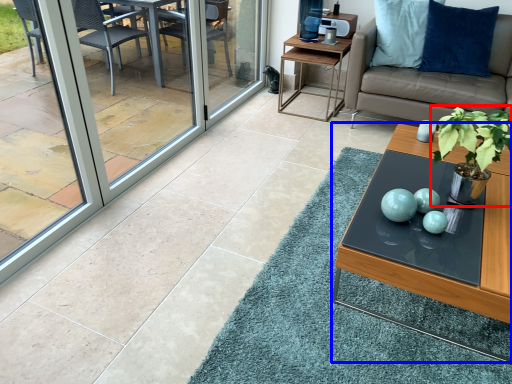
Question: Among these objects, which one is farthest to the camera, houseplant (highlighted by a red box) or coffee table (highlighted by a blue box)?

Choices:
 (A) houseplant
 (B) coffee table

Answer: (A)